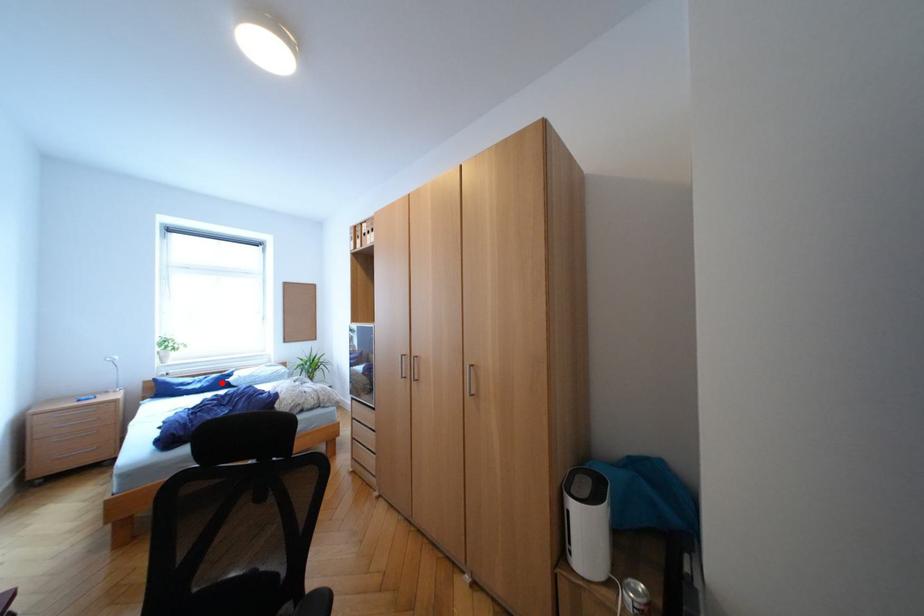
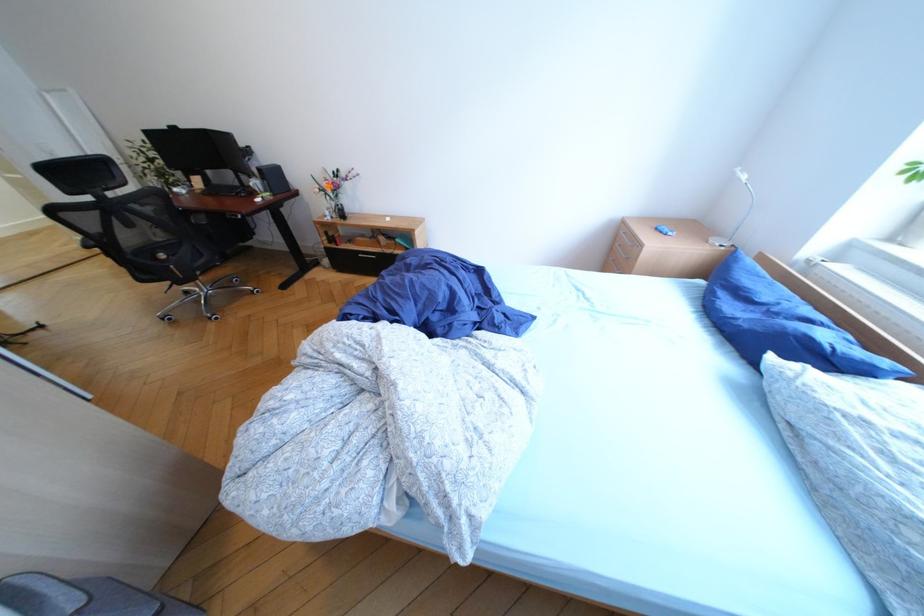
In the second image, find the point that corresponds to the highlighted location in the first image.

(768, 330)